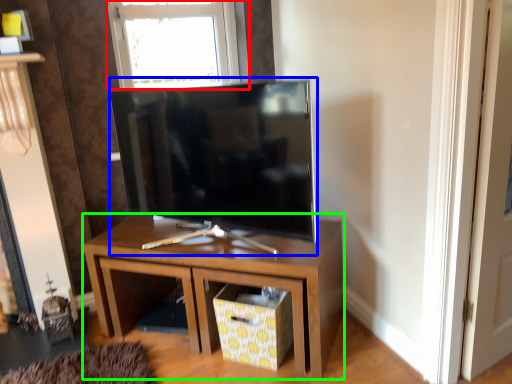
Question: Which object is the closest to the window (highlighted by a red box)? Choose among these: television (highlighted by a blue box) or nightstand (highlighted by a green box).

Choices:
 (A) television
 (B) nightstand

Answer: (A)